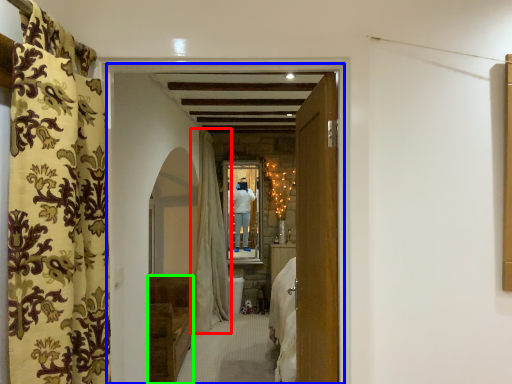
Question: Considering the real-world distances, which object is farthest from curtain (highlighted by a red box)? hotel lobby (highlighted by a blue box) or furniture (highlighted by a green box)?

Choices:
 (A) hotel lobby
 (B) furniture

Answer: (A)